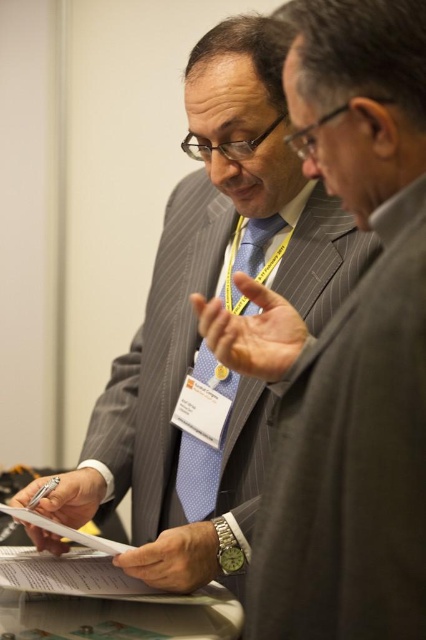
From the picture: Is pinstriped wool suit at center smaller than blue dotted tie at center?

Incorrect, pinstriped wool suit at center is not smaller in size than blue dotted tie at center.

Who is taller, pinstriped wool suit at center or blue dotted tie at center?

blue dotted tie at center is taller.

Is point (417, 264) closer to viewer compared to point (187, 477)?

Yes, point (417, 264) is in front of point (187, 477).

At what (x,y) coordinates should I click in order to perform the action: click on pinstriped wool suit at center. Please return your answer as a coordinate pair (x, y). The height and width of the screenshot is (640, 426). Looking at the image, I should click on (351, 460).